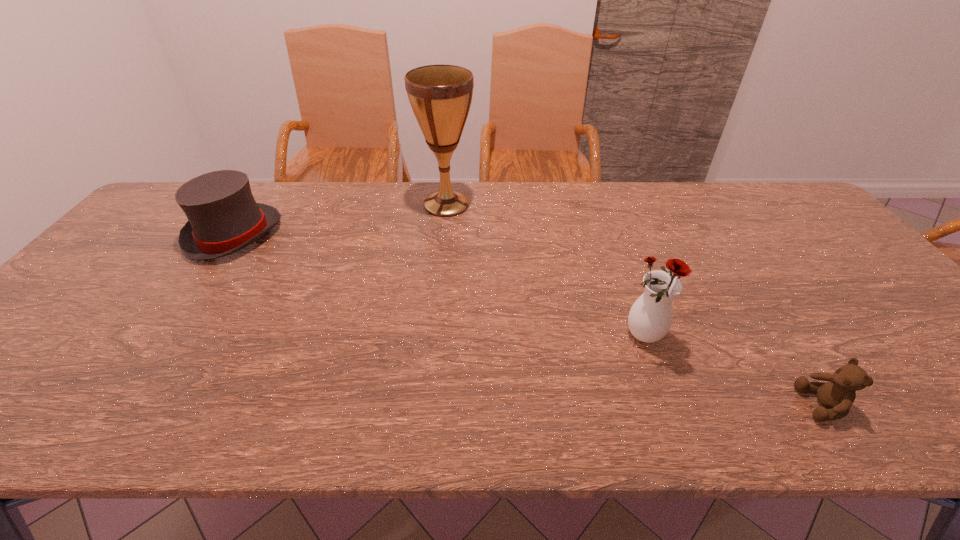
Identify the location of free space that satisfies the following two spatial constraints: 1. on the front side of the third object from right to left; 2. on the right side of the vase. The image size is (960, 540). [x=433, y=336].